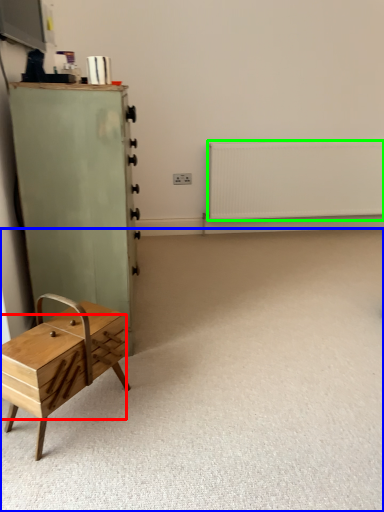
Question: Which object is positioned closest to drawer (highlighted by a red box)? Select from plain (highlighted by a blue box) and radiator (highlighted by a green box).

Choices:
 (A) plain
 (B) radiator

Answer: (A)